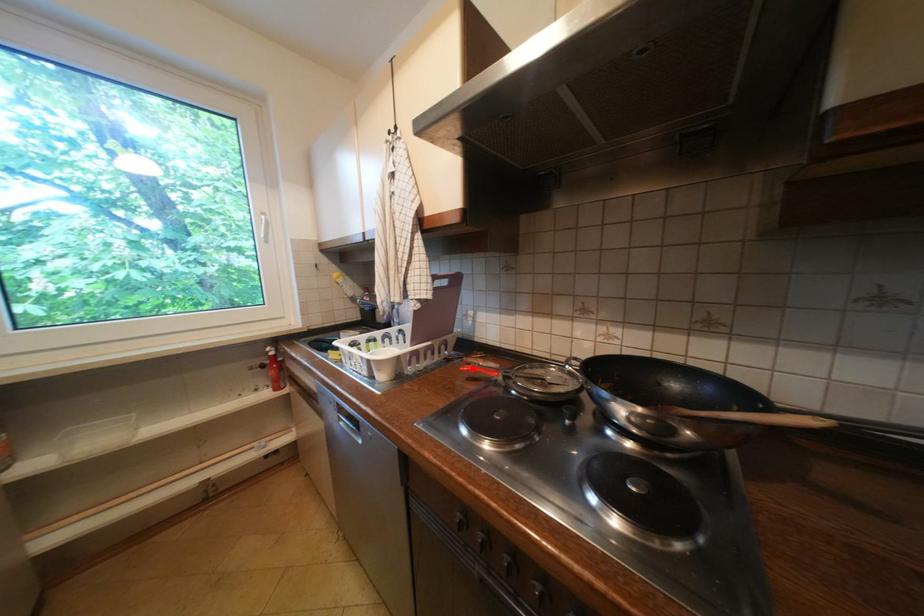
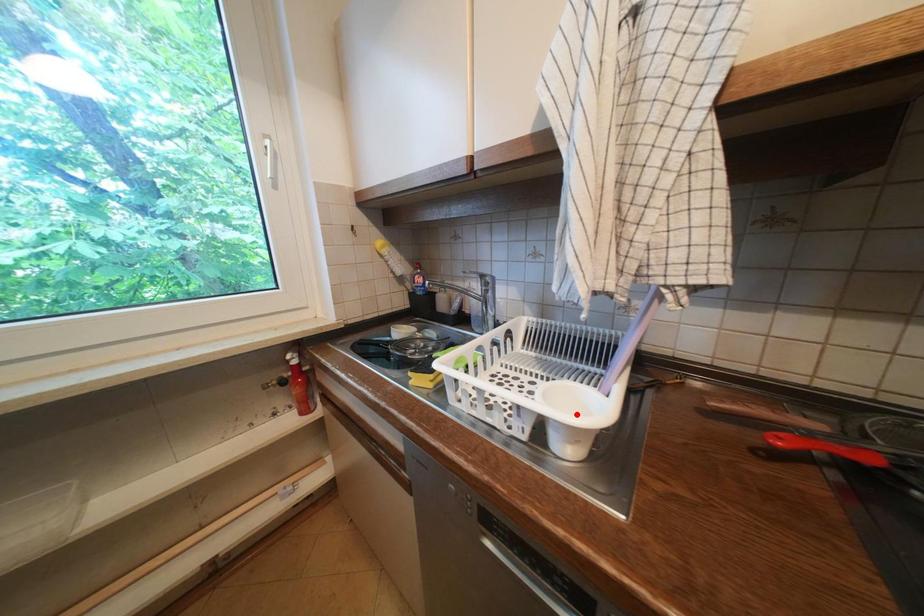
I am providing you with two images of the same scene from different viewpoints. A red point is marked on the first image and another point is marked on the second image. Do the highlighted points in image1 and image2 indicate the same real-world spot?

No